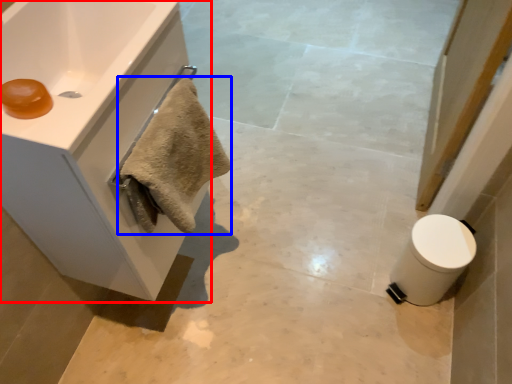
Question: Which object appears closest to the camera in this image, bathroom cabinet (highlighted by a red box) or bath towel (highlighted by a blue box)?

Choices:
 (A) bathroom cabinet
 (B) bath towel

Answer: (A)